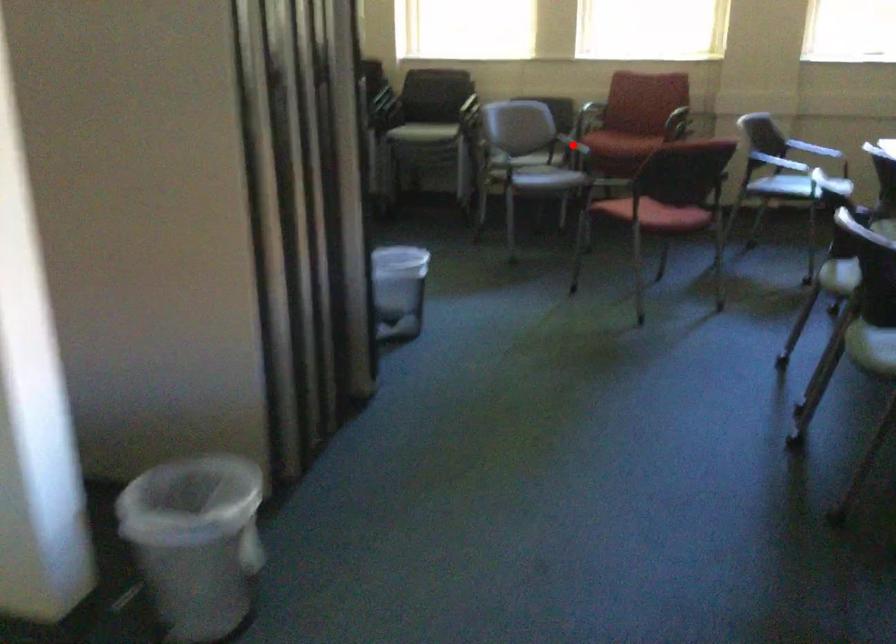
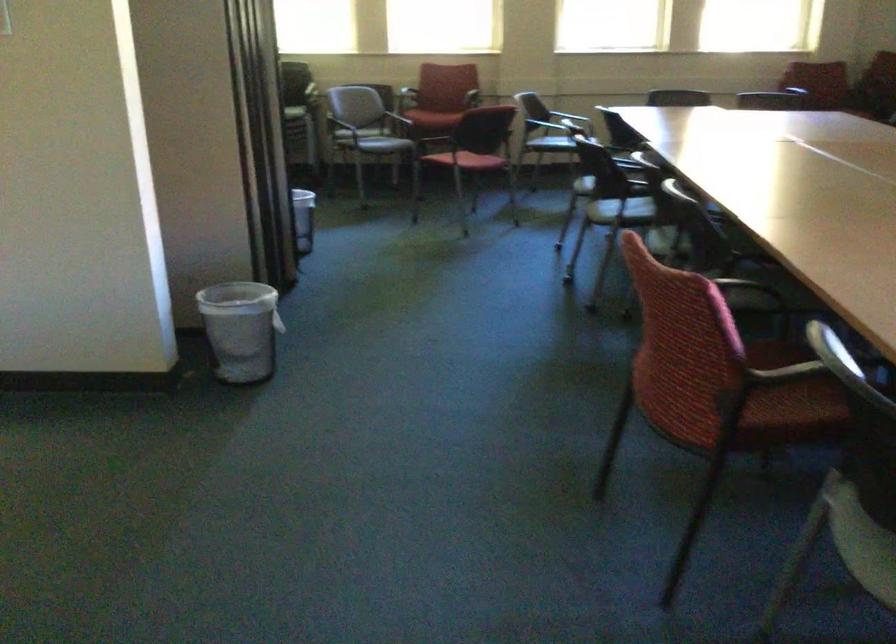
Question: I am providing you with two images of the same scene from different viewpoints. A red point is marked on the first image. Can you still see the location of the red point in image 2?

Choices:
 (A) Yes
 (B) No

Answer: (B)